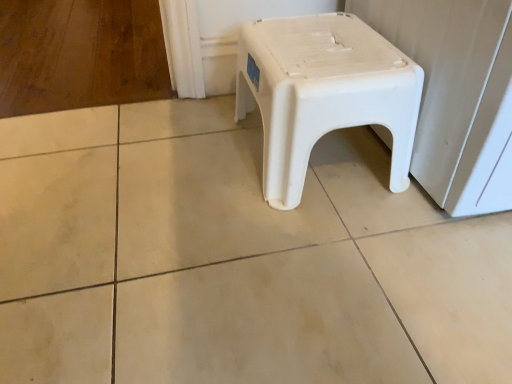
Find the location of a particular element. This screenshot has width=512, height=384. vacant region under white plastic stool at center (from a real-world perspective) is located at coordinates (335, 162).